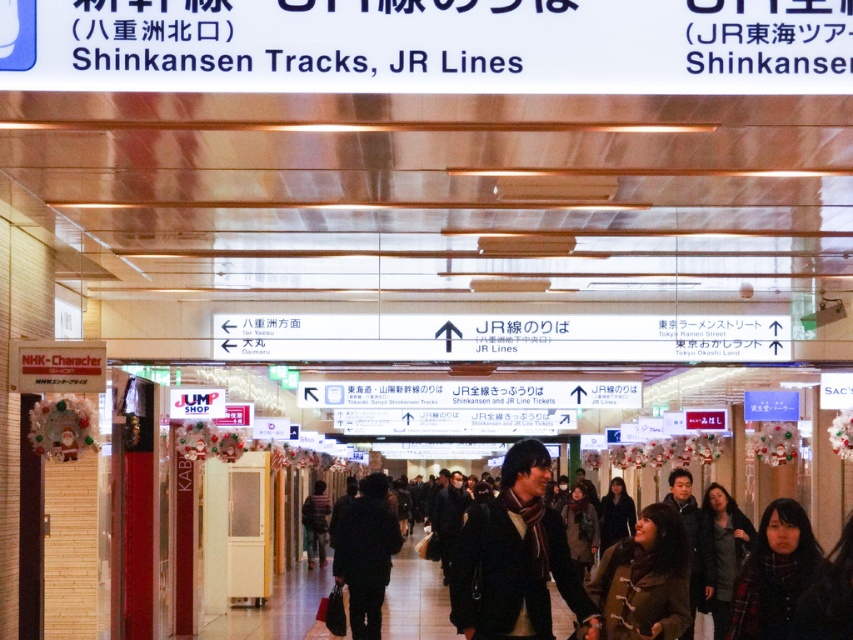
You are standing in the train station and see a brown leather jacket at lower right and a dark brown leather coat at center. Which one is positioned more to the right side of the station?

The brown leather jacket at lower right is positioned to the right of the dark brown leather coat at center, so it is more to the right side of the station.

You are standing in the train station and see both the dark brown scarf at center and the striped sweater at center. Which one is closer to you?

The dark brown scarf at center is closer to the viewer than the striped sweater at center.